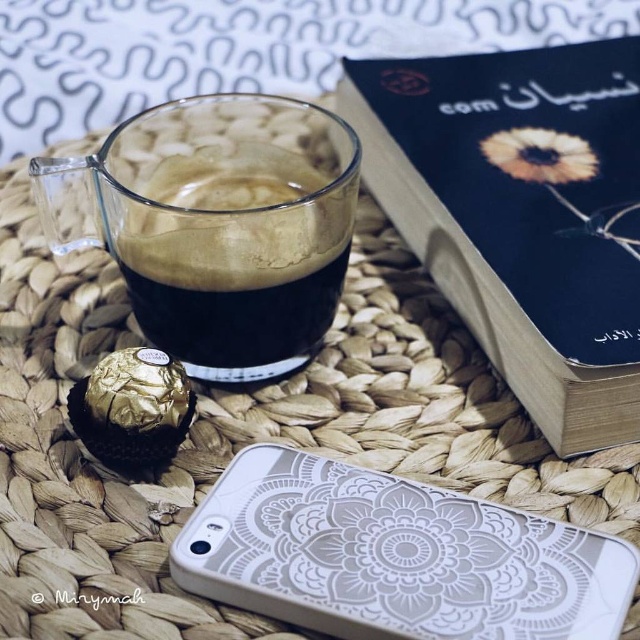
You are a person sitting on the floor and want to reach for the matte black book at upper right and the transparent glass cup at upper left. Which object is taller?

The matte black book at upper right is taller than the transparent glass cup at upper left according to the description.

You have a small cookie that is 3 cm in width. You want to place it next to the transparent glass cup at upper left and the white textured phone case at lower center. Which object can the cookie fit next to without overlapping?

The cookie can fit next to the transparent glass cup at upper left because it has a smaller width compared to the white textured phone case at lower center.

You are trying to reach for your phone case but there is a cup in the way. Which object is closer to you, the transparent glass cup at upper left or the white textured phone case at lower center?

The transparent glass cup at upper left is closer to you than the white textured phone case at lower center, so you need to move the cup to access the phone case.